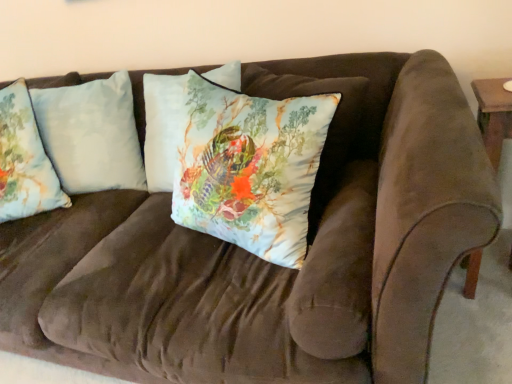
Question: Can we say silky floral pillow at center, positioned as the first pillow in right-to-left order, lies outside light blue fabric pillow at left, placed as the third pillow when sorted from right to left?

Choices:
 (A) yes
 (B) no

Answer: (A)

Question: Can light blue fabric pillow at left, placed as the third pillow when sorted from right to left, be found inside silky floral pillow at center, marked as the third pillow in a left-to-right arrangement?

Choices:
 (A) yes
 (B) no

Answer: (B)

Question: Does silky floral pillow at center, positioned as the first pillow in right-to-left order, have a greater height compared to light blue fabric pillow at left, the first pillow from the left?

Choices:
 (A) yes
 (B) no

Answer: (A)

Question: Considering the relative sizes of silky floral pillow at center, marked as the third pillow in a left-to-right arrangement, and light blue fabric pillow at left, placed as the third pillow when sorted from right to left, in the image provided, is silky floral pillow at center, marked as the third pillow in a left-to-right arrangement, thinner than light blue fabric pillow at left, placed as the third pillow when sorted from right to left,?

Choices:
 (A) yes
 (B) no

Answer: (B)

Question: Is the depth of silky floral pillow at center, marked as the third pillow in a left-to-right arrangement, less than that of light blue fabric pillow at left, placed as the third pillow when sorted from right to left?

Choices:
 (A) no
 (B) yes

Answer: (B)

Question: Is point (39, 145) positioned closer to the camera than point (279, 107)?

Choices:
 (A) farther
 (B) closer

Answer: (A)

Question: In terms of width, does light blue fabric pillow at left, placed as the third pillow when sorted from right to left, look wider or thinner when compared to silky floral pillow at center, marked as the third pillow in a left-to-right arrangement?

Choices:
 (A) thin
 (B) wide

Answer: (A)

Question: In terms of size, does light blue fabric pillow at left, the first pillow from the left, appear bigger or smaller than silky floral pillow at center, positioned as the first pillow in right-to-left order?

Choices:
 (A) big
 (B) small

Answer: (B)

Question: Relative to silky floral pillow at center, marked as the third pillow in a left-to-right arrangement, is light blue fabric pillow at left, placed as the third pillow when sorted from right to left, in front or behind?

Choices:
 (A) front
 (B) behind

Answer: (B)

Question: From their relative heights in the image, would you say silky floral pillow at center, positioned as the first pillow in right-to-left order, is taller or shorter than light blue fabric pillow at left, the first pillow from the left?

Choices:
 (A) tall
 (B) short

Answer: (A)

Question: In terms of size, does silky floral pillow at center, marked as the third pillow in a left-to-right arrangement, appear bigger or smaller than light blue fabric pillow at left, the first pillow from the left?

Choices:
 (A) big
 (B) small

Answer: (A)

Question: From the image's perspective, relative to light blue fabric pillow at left, the first pillow from the left, is silky floral pillow at center, marked as the third pillow in a left-to-right arrangement, above or below?

Choices:
 (A) below
 (B) above

Answer: (A)

Question: Does point (190, 107) appear closer or farther from the camera than point (19, 180)?

Choices:
 (A) farther
 (B) closer

Answer: (B)

Question: From the image's perspective, is light blue fabric pillow at left, placed as the third pillow when sorted from right to left, above or below light blue fabric pillow at left, which ranks as the second pillow in right-to-left order?

Choices:
 (A) above
 (B) below

Answer: (B)

Question: From a real-world perspective, is light blue fabric pillow at left, placed as the third pillow when sorted from right to left, physically located above or below light blue fabric pillow at left, which ranks as the second pillow in right-to-left order?

Choices:
 (A) above
 (B) below

Answer: (A)